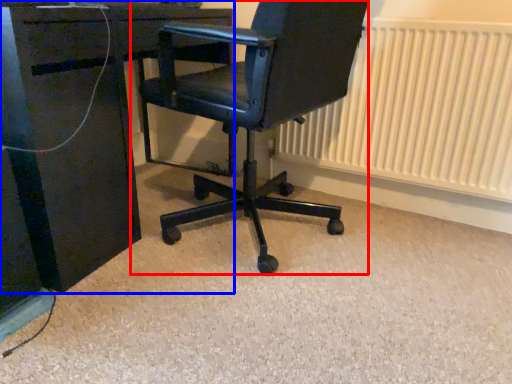
Question: Among these objects, which one is farthest to the camera, chair (highlighted by a red box) or desk (highlighted by a blue box)?

Choices:
 (A) chair
 (B) desk

Answer: (B)